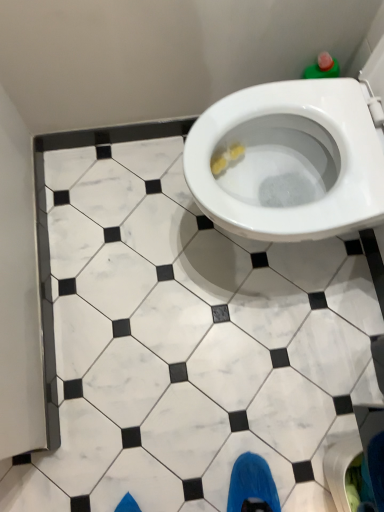
Where is `vacant area situated to the left side of white glossy toilet at center`? This screenshot has width=384, height=512. vacant area situated to the left side of white glossy toilet at center is located at coordinates (131, 239).